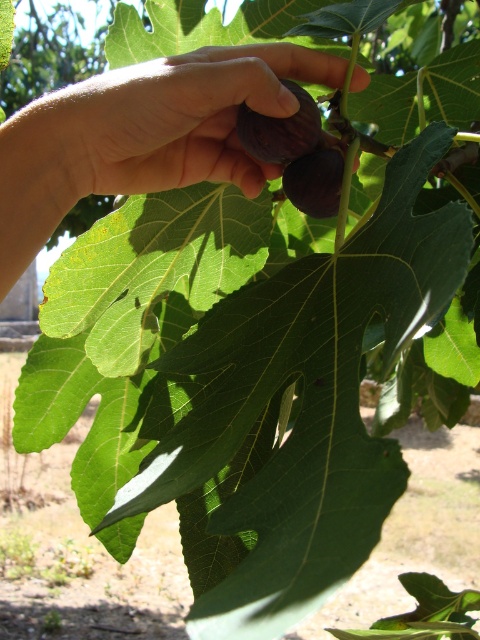
In the scene shown: You are a gardener checking the figs on a tree. You see the purple matte fig at center and the green matte fig at center. Which one is taller?

The green matte fig at center is taller than the purple matte fig at center.

You are a gardener trying to harvest figs from a tree. You notice two figs at the center of the image, the matte purple figs at center and the purple matte fig at center. Which one is located below the other?

The matte purple figs at center is positioned under the purple matte fig at center, meaning it is located below the other.

You are a photographer trying to capture a closeup of the figs. You notice two points in the scene labeled as point 1 and point 2. If point 1 is at coordinate point (4, 193) and point 2 is at coordinate point (273, 125), which point is closer to your camera lens?

Point 1 at coordinate point (4, 193) is closer to the camera lens than point 2 at coordinate point (273, 125).